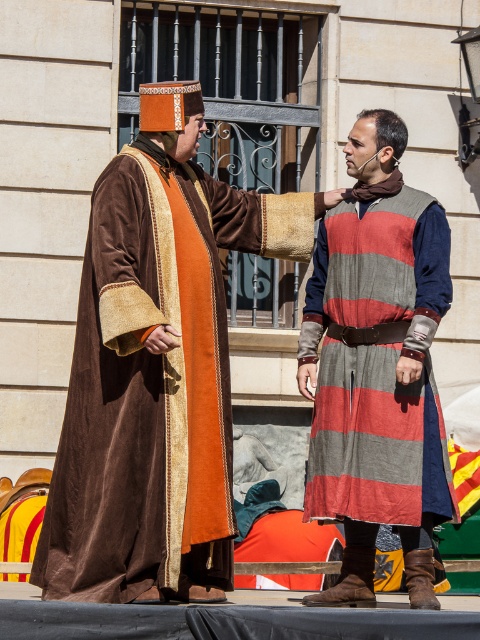
Question: Which object appears farthest from the camera in this image?

Choices:
 (A) striped woolen tunic at center
 (B) velvet brown robe at left

Answer: (A)

Question: Considering the relative positions of velvet brown robe at left and striped woolen tunic at center in the image provided, where is velvet brown robe at left located with respect to striped woolen tunic at center?

Choices:
 (A) right
 (B) left

Answer: (B)

Question: Is velvet brown robe at left to the right of striped woolen tunic at center from the viewer's perspective?

Choices:
 (A) no
 (B) yes

Answer: (A)

Question: Can you confirm if velvet brown robe at left is positioned to the left of striped woolen tunic at center?

Choices:
 (A) no
 (B) yes

Answer: (B)

Question: Which point appears closest to the camera in this image?

Choices:
 (A) (212, 456)
 (B) (365, 195)

Answer: (A)

Question: Which object appears closest to the camera in this image?

Choices:
 (A) velvet brown robe at left
 (B) striped woolen tunic at center

Answer: (A)